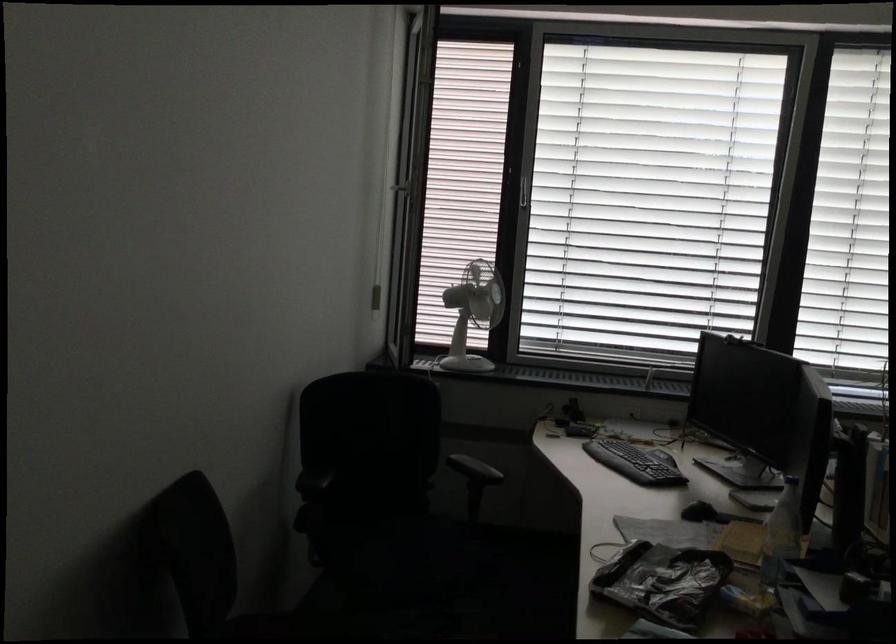
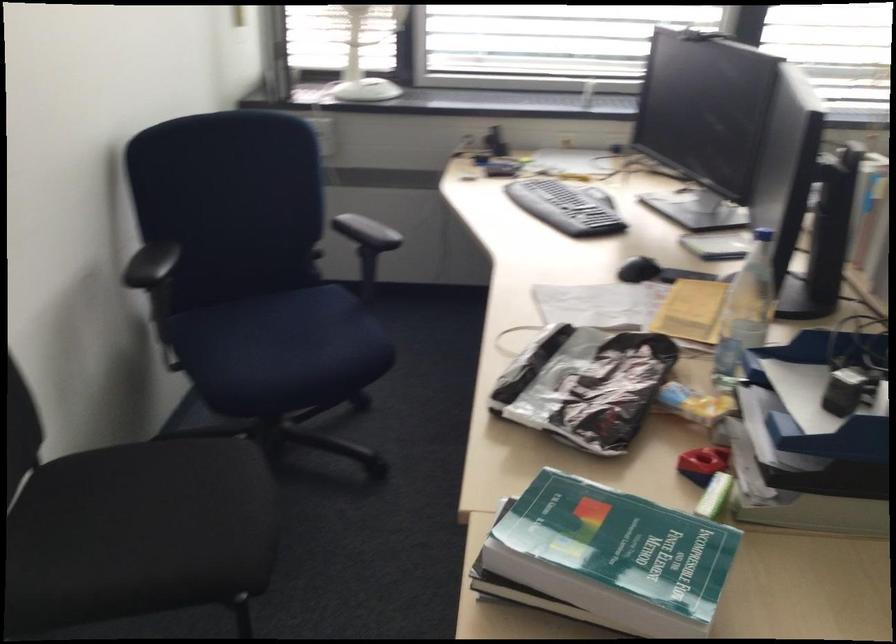
In the second image, find the point that corresponds to pixel 400 554 in the first image.

(278, 346)